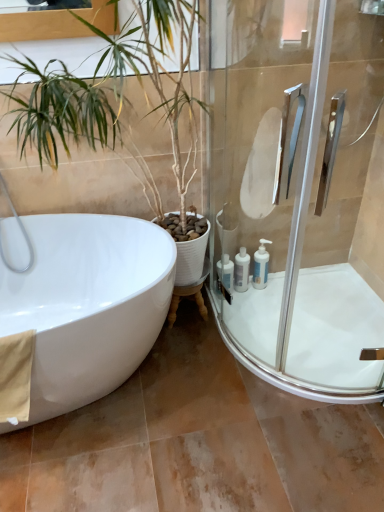
This screenshot has height=512, width=384. Find the location of `vacant area that is in front of white plastic bottles at right, marked as the first toiletry in a right-to-left arrangement`. vacant area that is in front of white plastic bottles at right, marked as the first toiletry in a right-to-left arrangement is located at coordinates (258, 307).